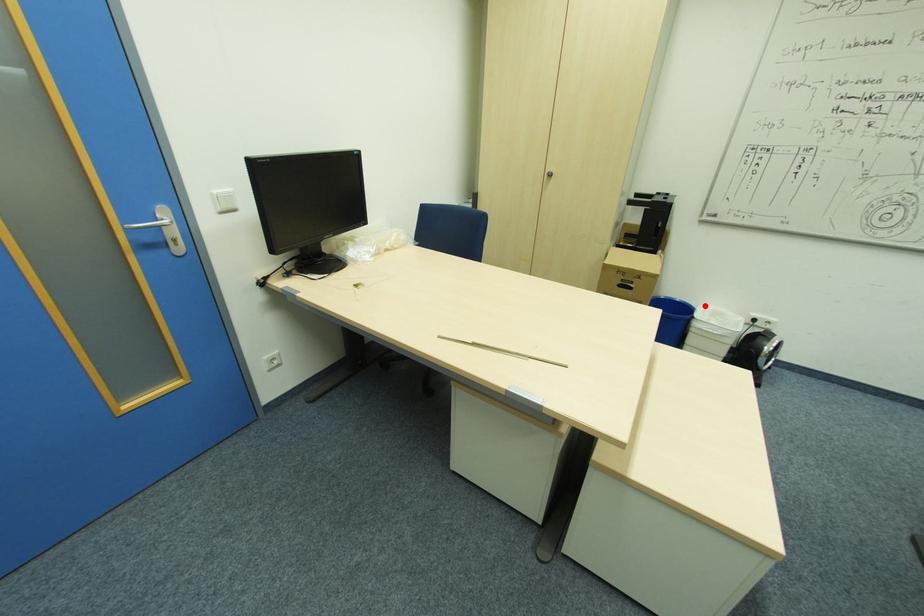
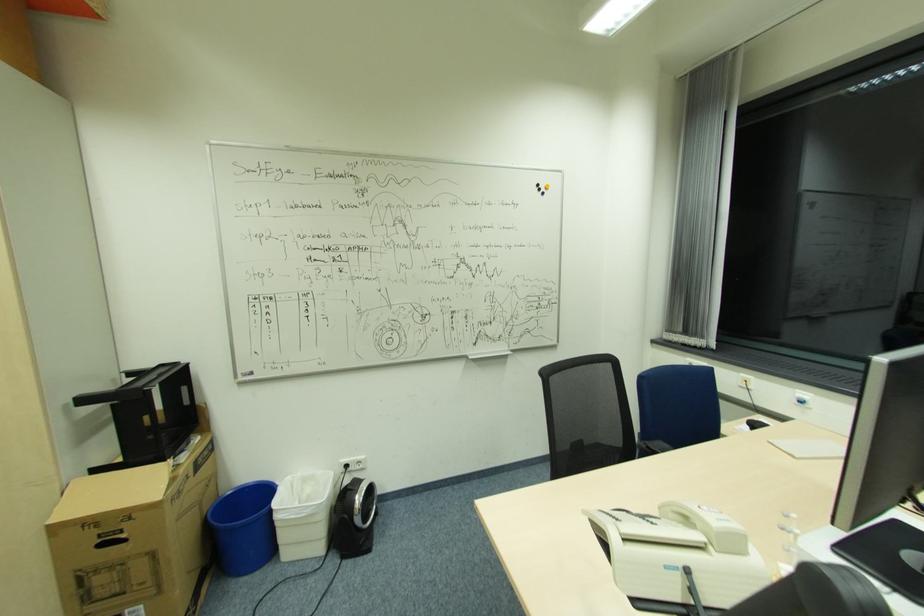
The point at the highlighted location is marked in the first image. Where is the corresponding point in the second image?

(290, 477)